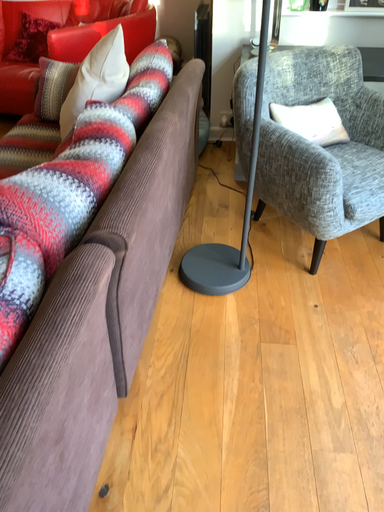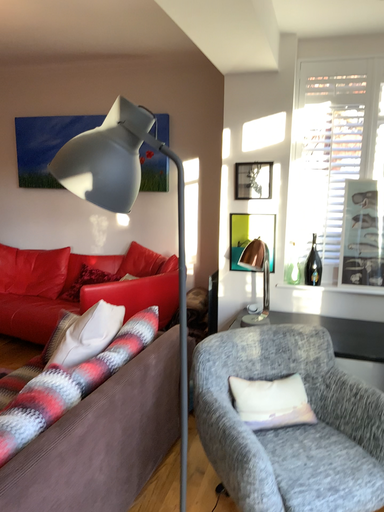
Question: How did the camera likely rotate when shooting the video?

Choices:
 (A) rotated left
 (B) rotated right

Answer: (A)